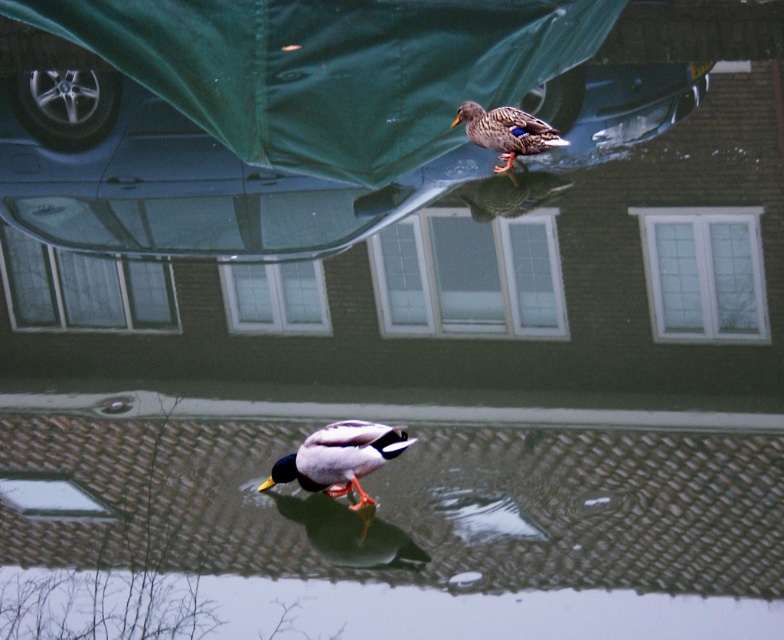
You are a photographer trying to capture the reflection of the metallic blue car at upper center and the matte brown duck at upper center in the water. Which object will have its reflection closer to the water surface?

The matte brown duck at upper center will have its reflection closer to the water surface because the metallic blue car at upper center is above it, so the duck is lower and its reflection would be nearer the water surface.